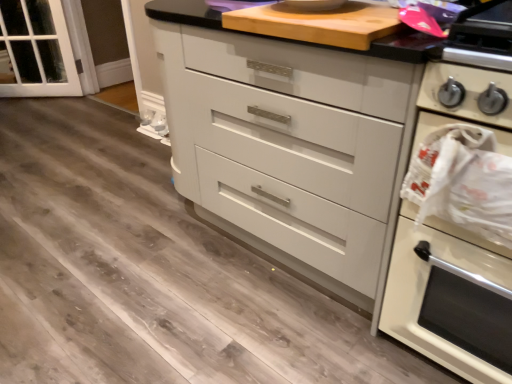
Question: Is white glossy oven at right to the left or to the right of white glossy chest of drawers at center in the image?

Choices:
 (A) right
 (B) left

Answer: (A)

Question: From the image's perspective, is white glossy oven at right above or below white glossy chest of drawers at center?

Choices:
 (A) below
 (B) above

Answer: (A)

Question: Which is farther from the clear glass door at left?

Choices:
 (A) white glossy chest of drawers at center
 (B) white glossy oven at right
 (C) wooden cutting board at upper center

Answer: (B)

Question: Which is nearer to the wooden cutting board at upper center?

Choices:
 (A) clear glass door at left
 (B) white glossy chest of drawers at center
 (C) white glossy oven at right

Answer: (B)